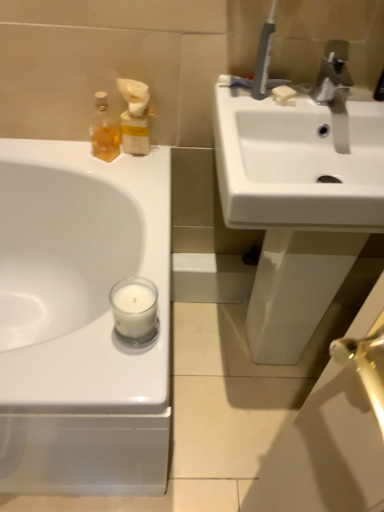
Question: Would you say white matte soap at upper right is part of white glossy sink at upper right, which is the second sink in left-to-right order,'s contents?

Choices:
 (A) yes
 (B) no

Answer: (B)

Question: Can you confirm if white glossy sink at upper right, which is the second sink in left-to-right order, is shorter than white matte soap at upper right?

Choices:
 (A) yes
 (B) no

Answer: (B)

Question: Is white glossy sink at upper right, which is the second sink in left-to-right order, to the left of white matte soap at upper right from the viewer's perspective?

Choices:
 (A) no
 (B) yes

Answer: (A)

Question: From a real-world perspective, is white glossy sink at upper right, the 1th sink when ordered from right to left, physically above white matte soap at upper right?

Choices:
 (A) yes
 (B) no

Answer: (B)

Question: Is white glossy sink at upper right, the 1th sink when ordered from right to left, outside white matte soap at upper right?

Choices:
 (A) no
 (B) yes

Answer: (B)

Question: From the image's perspective, is white glossy sink at upper right, the 1th sink when ordered from right to left, over white matte soap at upper right?

Choices:
 (A) yes
 (B) no

Answer: (B)

Question: Can you confirm if white matte soap at upper right is positioned to the right of white glossy sink at upper left, the first sink from the left?

Choices:
 (A) yes
 (B) no

Answer: (A)

Question: Considering the relative sizes of white matte soap at upper right and white glossy sink at upper left, the first sink from the left, in the image provided, is white matte soap at upper right thinner than white glossy sink at upper left, the first sink from the left,?

Choices:
 (A) yes
 (B) no

Answer: (A)

Question: Can you confirm if white matte soap at upper right is positioned to the left of white glossy sink at upper left, the first sink from the left?

Choices:
 (A) yes
 (B) no

Answer: (B)

Question: From the image's perspective, is white matte soap at upper right above white glossy sink at upper left, placed as the 2th sink when sorted from right to left?

Choices:
 (A) no
 (B) yes

Answer: (B)

Question: Is white glossy sink at upper left, placed as the 2th sink when sorted from right to left, completely or partially inside white matte soap at upper right?

Choices:
 (A) yes
 (B) no

Answer: (B)

Question: Is white matte soap at upper right directly adjacent to white glossy sink at upper left, the first sink from the left?

Choices:
 (A) no
 (B) yes

Answer: (A)

Question: From a real-world perspective, is translucent glass bottle at upper left positioned over white matte glass candle at lower center based on gravity?

Choices:
 (A) yes
 (B) no

Answer: (A)